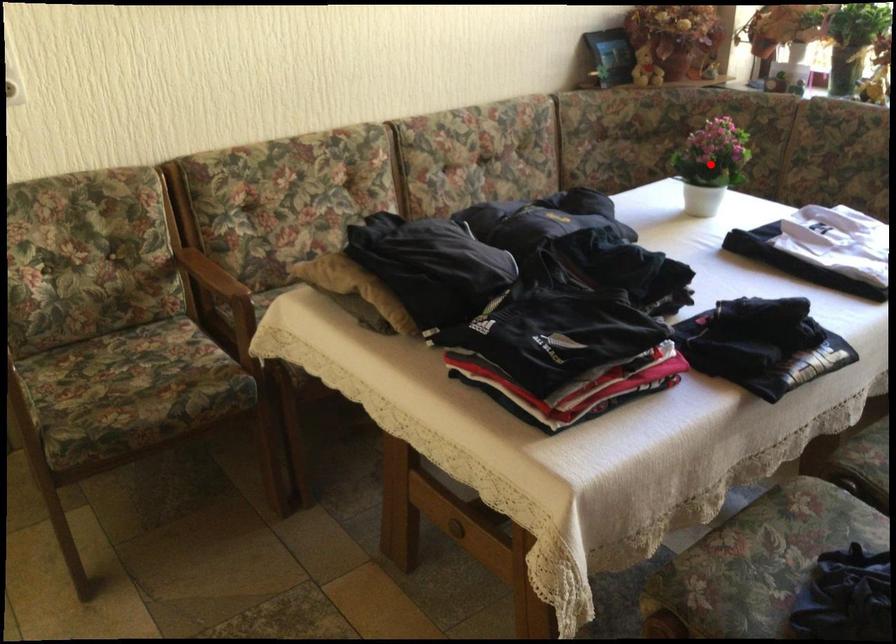
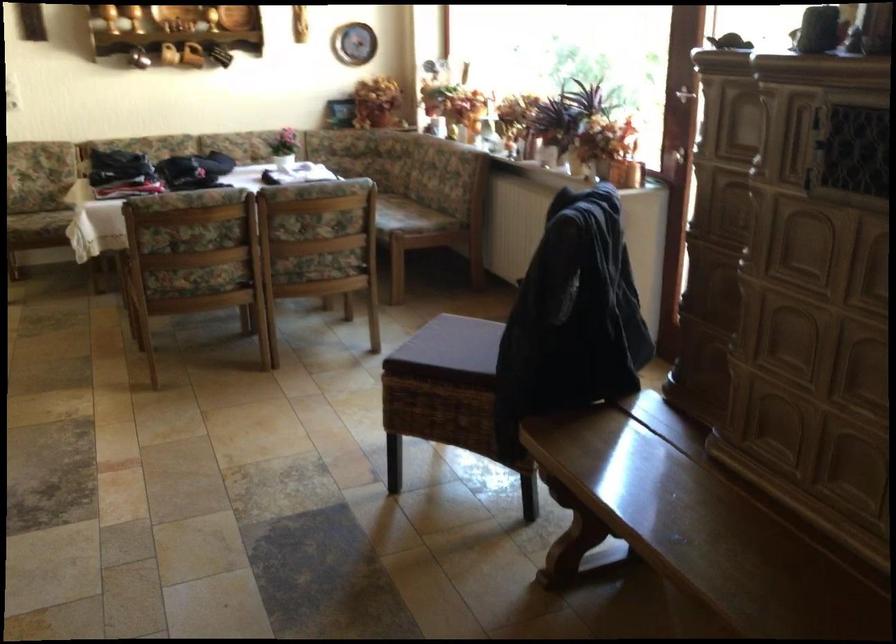
Question: I am providing you with two images of the same scene from different viewpoints. A red point is marked on the first image. At the location where the point appears in image 1, is it still visible in image 2?

Choices:
 (A) Yes
 (B) No

Answer: (B)